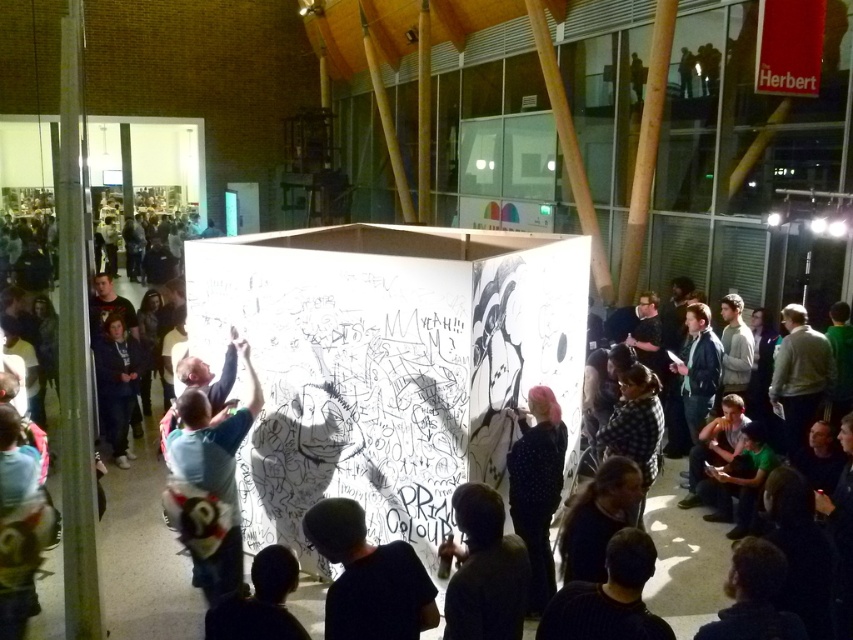
Question: Estimate the real-world distances between objects in this image. Which object is farther from the dark blue hoodie at center?

Choices:
 (A) black striped shirt at lower center
 (B) dark blue shirt at center
 (C) light blue t-shirt at center

Answer: (A)

Question: Can you confirm if dark gray hoodie at center is positioned below dark blue shirt at center?

Choices:
 (A) no
 (B) yes

Answer: (A)

Question: Is dark blue shirt at center thinner than black striped shirt at lower center?

Choices:
 (A) yes
 (B) no

Answer: (A)

Question: Is light blue t-shirt at center wider than pink hair at center?

Choices:
 (A) yes
 (B) no

Answer: (A)

Question: Which of the following is the farthest from the observer?

Choices:
 (A) dark blue hoodie at center
 (B) black striped shirt at lower center
 (C) dark gray hoodie at center

Answer: (A)

Question: Which point is farther to the camera?

Choices:
 (A) light blue t-shirt at center
 (B) dark blue hoodie at center
 (C) black striped shirt at lower center
 (D) dark blue shirt at center

Answer: (B)